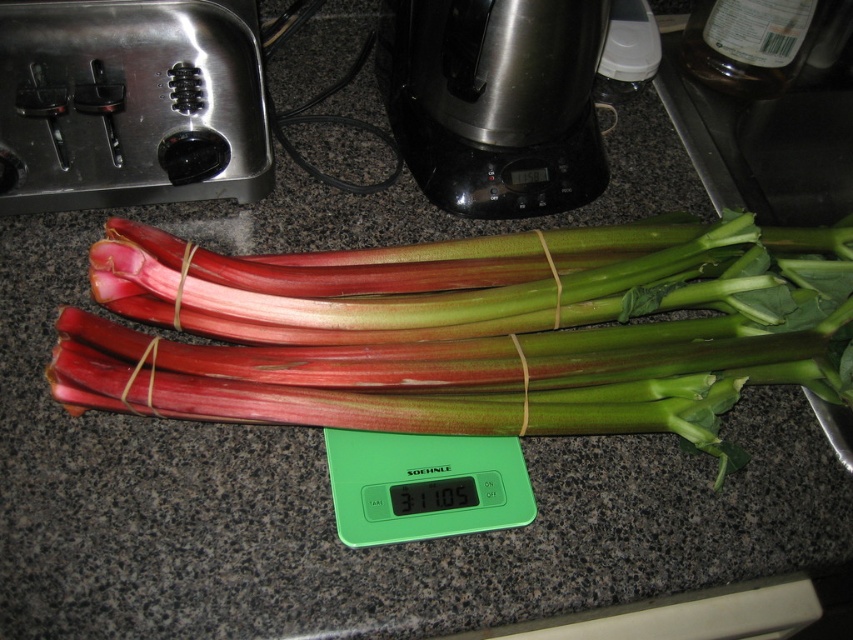
Is stainless steel blender at center smaller than green plastic scale at center?

Actually, stainless steel blender at center might be larger than green plastic scale at center.

Image resolution: width=853 pixels, height=640 pixels. Describe the element at coordinates (495, 100) in the screenshot. I see `stainless steel blender at center` at that location.

Where is `stainless steel blender at center`? The image size is (853, 640). stainless steel blender at center is located at coordinates (495, 100).

Does pinkish-red fibrous rhubarb at center have a lesser width compared to green plastic scale at center?

Incorrect, pinkish-red fibrous rhubarb at center's width is not less than green plastic scale at center's.

Is point (296, 422) positioned before point (334, 508)?

Yes, point (296, 422) is closer to viewer.

Who is more distant from viewer, (350, 308) or (519, 513)?

Positioned behind is point (350, 308).

Identify the location of pinkish-red fibrous rhubarb at center. This screenshot has height=640, width=853. (456, 330).

Looking at this image, is pinkish-red fibrous rhubarb at center to the right of stainless steel blender at center from the viewer's perspective?

Correct, you'll find pinkish-red fibrous rhubarb at center to the right of stainless steel blender at center.

Between pinkish-red fibrous rhubarb at center and stainless steel blender at center, which one is positioned lower?

Positioned lower is pinkish-red fibrous rhubarb at center.

This screenshot has height=640, width=853. Find the location of `pinkish-red fibrous rhubarb at center`. pinkish-red fibrous rhubarb at center is located at coordinates (456, 330).